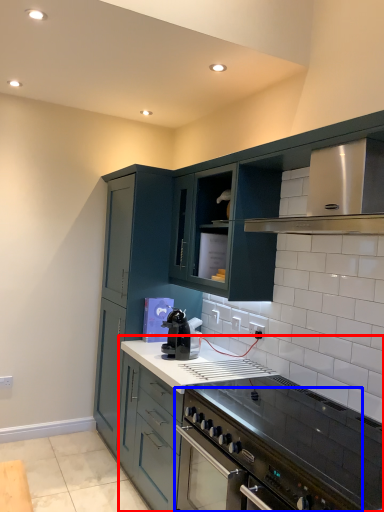
Question: Which object is closer to the camera taking this photo, countertop (highlighted by a red box) or kitchen appliance (highlighted by a blue box)?

Choices:
 (A) countertop
 (B) kitchen appliance

Answer: (B)